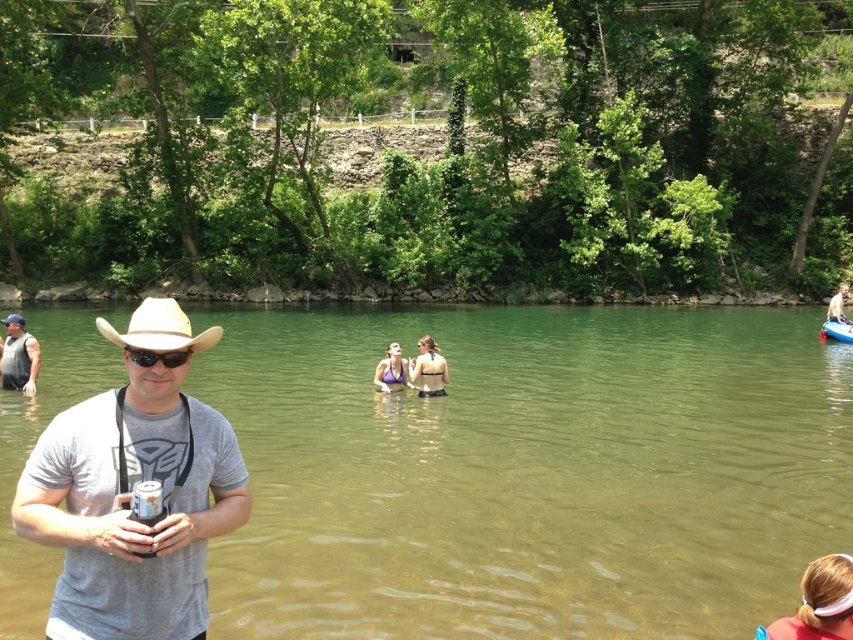
You are a photographer positioned at the riverbank and want to capture a photo of both the matte black bikini at center and the purple fabric bikini at center. Which one should you focus on first to ensure both are in the frame?

You should focus on the matte black bikini at center first because it is closer to the viewer than the purple fabric bikini at center, allowing both to be in the frame when adjusting the camera.